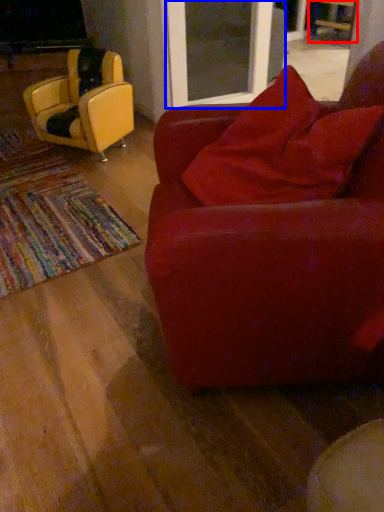
Question: Which object is closer to the camera taking this photo, chair (highlighted by a red box) or screen door (highlighted by a blue box)?

Choices:
 (A) chair
 (B) screen door

Answer: (B)